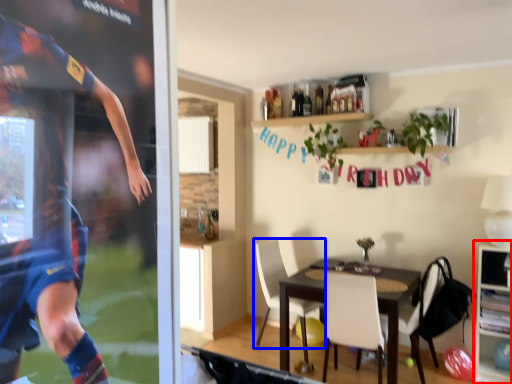
Question: Which object is closer to the camera taking this photo, cabinetry (highlighted by a red box) or chair (highlighted by a blue box)?

Choices:
 (A) cabinetry
 (B) chair

Answer: (A)